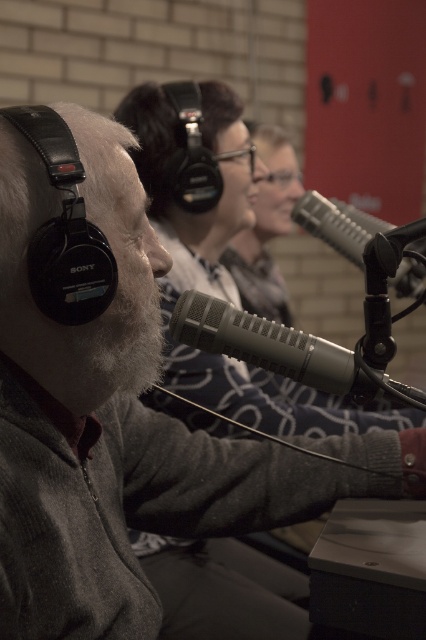
Question: Which point is closer to the camera?

Choices:
 (A) (333, 368)
 (B) (319, 236)

Answer: (A)

Question: Observing the image, what is the correct spatial positioning of matte black microphone at center in reference to silver metallic microphone at center?

Choices:
 (A) above
 (B) below

Answer: (B)

Question: Is matte black microphone at center in front of silver metallic microphone at center?

Choices:
 (A) no
 (B) yes

Answer: (B)

Question: Is matte black microphone at center positioned at the back of silver metallic microphone at center?

Choices:
 (A) yes
 (B) no

Answer: (B)